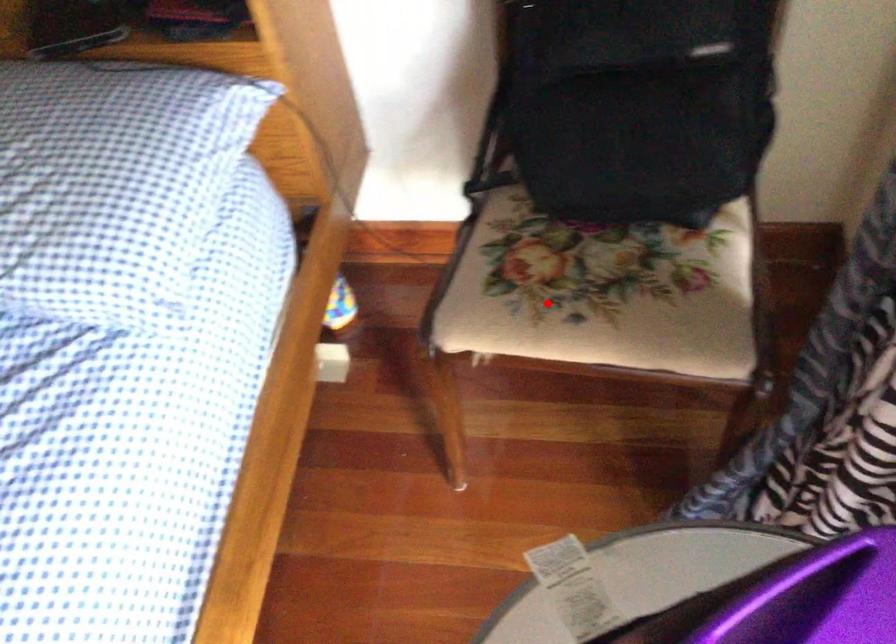
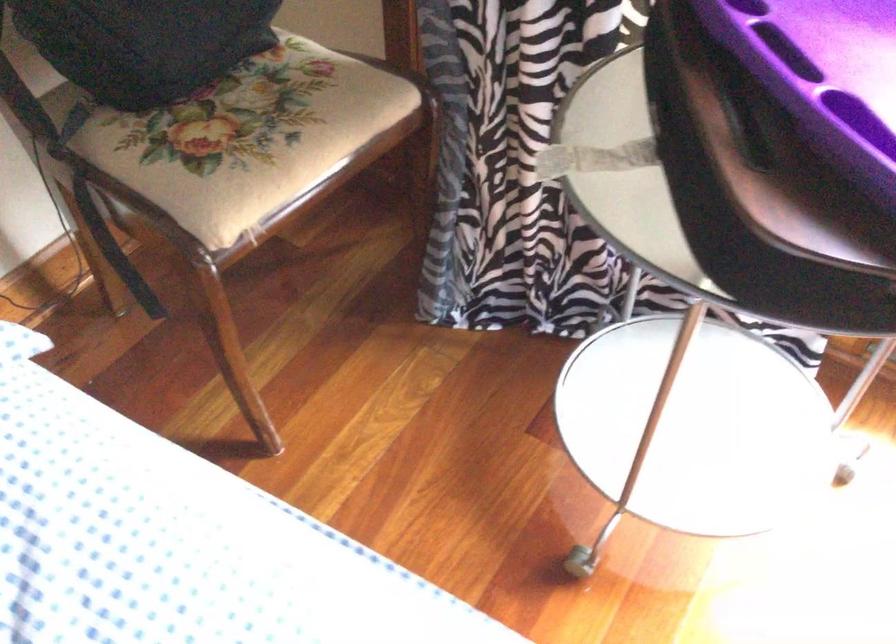
Where in the second image is the point corresponding to the highlighted location from the first image?

(259, 145)